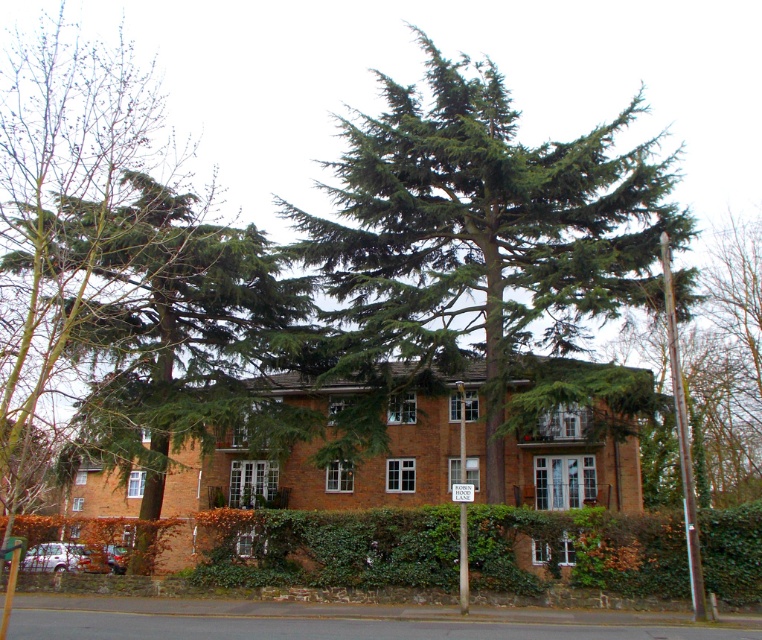
Question: Based on their relative distances, which object is farther from the green needle-like leaves at center?

Choices:
 (A) white plastic sign at center
 (B) green leafy tree at center

Answer: (A)

Question: Is green needle-like leaves at center to the right of white plastic sign at center from the viewer's perspective?

Choices:
 (A) no
 (B) yes

Answer: (B)

Question: Which point is closer to the camera taking this photo?

Choices:
 (A) (469, 486)
 (B) (122, 436)
 (C) (420, 340)

Answer: (A)

Question: Which point is farther from the camera taking this photo?

Choices:
 (A) (226, 337)
 (B) (450, 484)

Answer: (B)

Question: Where is green leafy tree at center located in relation to white plastic sign at center in the image?

Choices:
 (A) right
 (B) left

Answer: (B)

Question: Can you confirm if green leafy tree at center is smaller than white plastic sign at center?

Choices:
 (A) no
 (B) yes

Answer: (A)